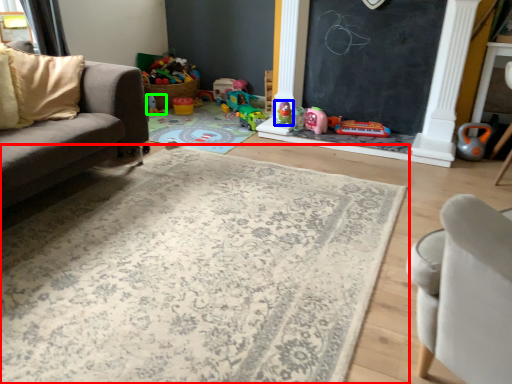
Question: Based on their relative distances, which object is nearer to mat (highlighted by a red box)? Choose from toy (highlighted by a blue box) and toy (highlighted by a green box).

Choices:
 (A) toy
 (B) toy

Answer: (A)